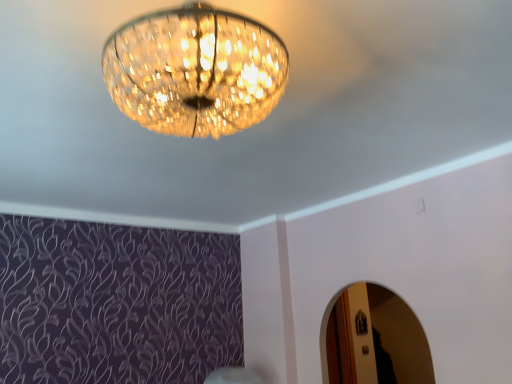
Measure the distance between crystal glass chandelier at upper center and camera.

34.28 inches.

This screenshot has height=384, width=512. I want to click on crystal glass chandelier at upper center, so click(x=195, y=71).

Describe the element at coordinates (195, 71) in the screenshot. The width and height of the screenshot is (512, 384). I see `crystal glass chandelier at upper center` at that location.

In order to face crystal glass chandelier at upper center, should I rotate leftwards or rightwards?

It's best to rotate left around 7.597 degrees.

This screenshot has height=384, width=512. I want to click on metallic silver mirror at lower right, so click(x=375, y=339).

The width and height of the screenshot is (512, 384). Describe the element at coordinates (375, 339) in the screenshot. I see `metallic silver mirror at lower right` at that location.

What is the approximate width of metallic silver mirror at lower right?

8.51 centimeters.

I want to click on crystal glass chandelier at upper center, so click(x=195, y=71).

Between metallic silver mirror at lower right and crystal glass chandelier at upper center, which one appears on the left side from the viewer's perspective?

From the viewer's perspective, crystal glass chandelier at upper center appears more on the left side.

Is metallic silver mirror at lower right positioned before crystal glass chandelier at upper center?

No, the depth of metallic silver mirror at lower right is greater than that of crystal glass chandelier at upper center.

Which is nearer, (330, 365) or (208, 125)?

Point (330, 365) is positioned farther from the camera compared to point (208, 125).

From the image's perspective, is metallic silver mirror at lower right over crystal glass chandelier at upper center?

No, from the image's perspective, metallic silver mirror at lower right is not over crystal glass chandelier at upper center.

From a real-world perspective, is metallic silver mirror at lower right physically located above or below crystal glass chandelier at upper center?

In terms of real-world spatial position, metallic silver mirror at lower right is below crystal glass chandelier at upper center.

Considering the sizes of metallic silver mirror at lower right and crystal glass chandelier at upper center in the image, is metallic silver mirror at lower right wider or thinner than crystal glass chandelier at upper center?

metallic silver mirror at lower right is thinner than crystal glass chandelier at upper center.

Considering the sizes of metallic silver mirror at lower right and crystal glass chandelier at upper center in the image, is metallic silver mirror at lower right taller or shorter than crystal glass chandelier at upper center?

metallic silver mirror at lower right is taller than crystal glass chandelier at upper center.

Between metallic silver mirror at lower right and crystal glass chandelier at upper center, which one has smaller size?

With smaller size is metallic silver mirror at lower right.

Is crystal glass chandelier at upper center a part of metallic silver mirror at lower right?

No, crystal glass chandelier at upper center is not inside metallic silver mirror at lower right.

Is there a large distance between metallic silver mirror at lower right and crystal glass chandelier at upper center?

Yes.

Does metallic silver mirror at lower right turn towards crystal glass chandelier at upper center?

Yes.

The height and width of the screenshot is (384, 512). Identify the location of mirror below the crystal glass chandelier at upper center (from a real-world perspective). (375, 339).

Is crystal glass chandelier at upper center to the left of metallic silver mirror at lower right from the viewer's perspective?

Yes.

Considering the relative positions of crystal glass chandelier at upper center and metallic silver mirror at lower right in the image provided, is crystal glass chandelier at upper center in front of metallic silver mirror at lower right?

Yes, crystal glass chandelier at upper center is closer to the camera.

Is point (242, 79) more distant than point (419, 378)?

No, (242, 79) is in front of (419, 378).

From the image's perspective, between crystal glass chandelier at upper center and metallic silver mirror at lower right, who is located below?

metallic silver mirror at lower right is shown below in the image.

From a real-world perspective, is crystal glass chandelier at upper center located beneath metallic silver mirror at lower right?

No, from a real-world perspective, crystal glass chandelier at upper center is not beneath metallic silver mirror at lower right.

Is crystal glass chandelier at upper center thinner than metallic silver mirror at lower right?

No.

Which of these two, crystal glass chandelier at upper center or metallic silver mirror at lower right, stands shorter?

Standing shorter between the two is crystal glass chandelier at upper center.

Does crystal glass chandelier at upper center have a smaller size compared to metallic silver mirror at lower right?

No.

Choose the correct answer: Is crystal glass chandelier at upper center inside metallic silver mirror at lower right or outside it?

crystal glass chandelier at upper center is not inside metallic silver mirror at lower right, it's outside.

Are crystal glass chandelier at upper center and metallic silver mirror at lower right far apart?

That's right, there is a large distance between crystal glass chandelier at upper center and metallic silver mirror at lower right.

Is crystal glass chandelier at upper center positioned with its back to metallic silver mirror at lower right?

No, metallic silver mirror at lower right is not at the back of crystal glass chandelier at upper center.

How far apart are crystal glass chandelier at upper center and metallic silver mirror at lower right?

crystal glass chandelier at upper center is 3.43 meters from metallic silver mirror at lower right.

At what (x,y) coordinates should I click in order to perform the action: click on mirror below the crystal glass chandelier at upper center (from the image's perspective). Please return your answer as a coordinate pair (x, y). The image size is (512, 384). Looking at the image, I should click on (375, 339).

Find the location of `mirror that appears below the crystal glass chandelier at upper center (from a real-world perspective)`. mirror that appears below the crystal glass chandelier at upper center (from a real-world perspective) is located at coordinates (375, 339).

I want to click on lamp located above the metallic silver mirror at lower right (from a real-world perspective), so click(x=195, y=71).